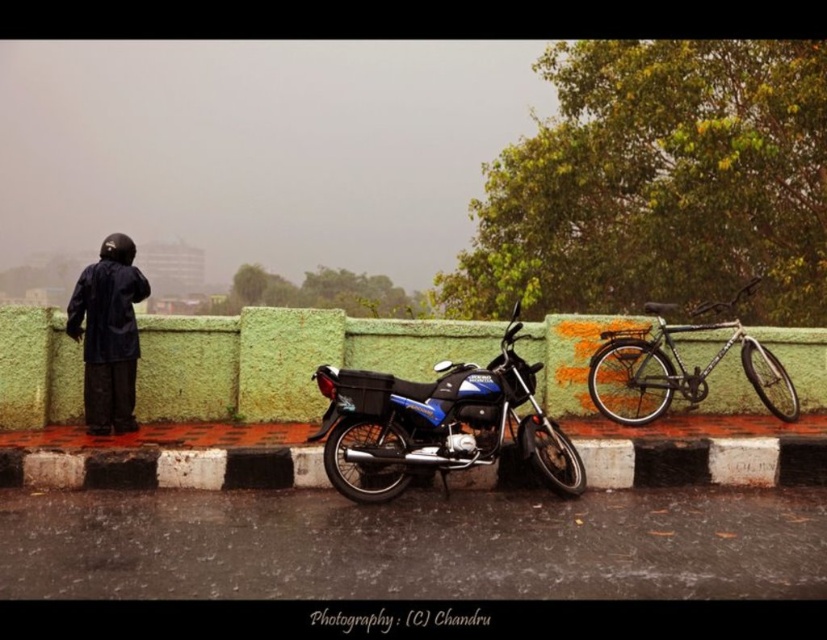
Is point (531, 356) positioned behind point (563, 493)?

Yes, it is behind point (563, 493).

Between point (3, 426) and point (366, 380), which one is positioned behind?

The point (3, 426) is more distant.

Describe the element at coordinates (284, 358) in the screenshot. I see `green concrete barrier at center` at that location.

Where is `green concrete barrier at center`? This screenshot has width=827, height=640. green concrete barrier at center is located at coordinates (284, 358).

Which is below, green concrete barrier at center or silver metallic bicycle at right?

green concrete barrier at center is below.

Is point (213, 339) closer to viewer compared to point (670, 392)?

No, (213, 339) is further to viewer.

You are a GUI agent. You are given a task and a screenshot of the screen. Output one action in this format:
    pyautogui.click(x=<x>, y=<y>)
    Task: Click on the green concrete barrier at center
    The image size is (827, 640).
    Given the screenshot: What is the action you would take?
    click(x=284, y=358)

Which is above, green concrete barrier at center or black matte jacket at left?

Positioned higher is black matte jacket at left.

Which is below, green concrete barrier at center or black matte jacket at left?

Positioned lower is green concrete barrier at center.

Is point (192, 330) positioned before point (98, 412)?

No, (192, 330) is further to viewer.

This screenshot has height=640, width=827. In order to click on green concrete barrier at center in this screenshot , I will do `click(284, 358)`.